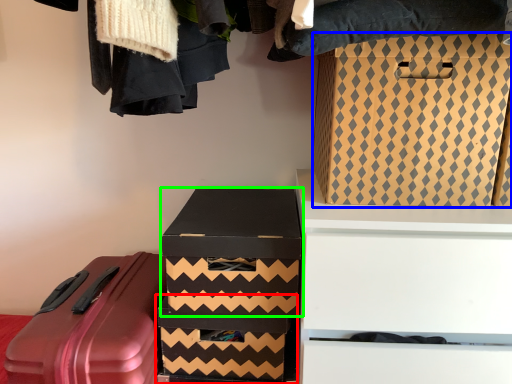
Question: Considering the real-world distances, which object is farthest from box (highlighted by a red box)? box (highlighted by a blue box) or box (highlighted by a green box)?

Choices:
 (A) box
 (B) box

Answer: (A)